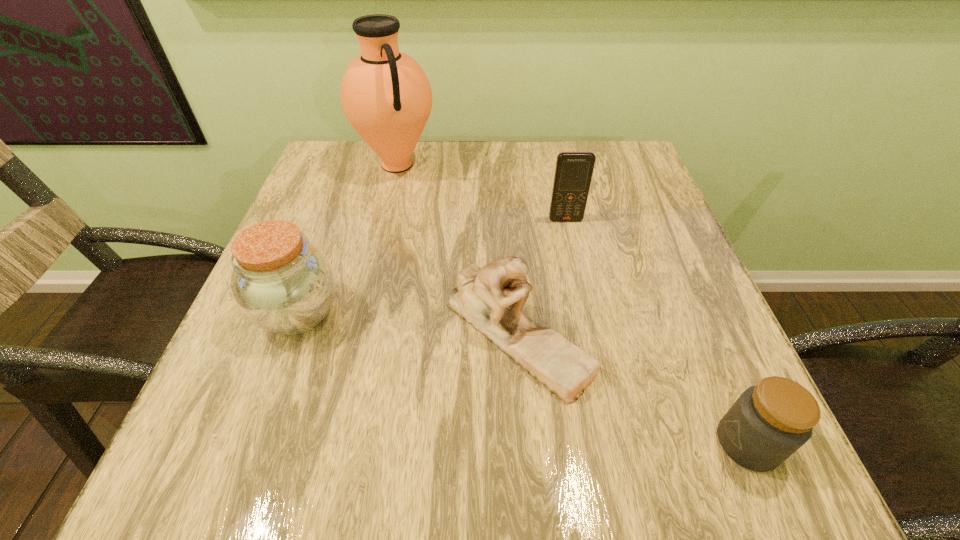
In order to click on the farthest object in this screenshot , I will do `click(385, 94)`.

Identify the location of the tallest object. (385, 94).

You are a GUI agent. You are given a task and a screenshot of the screen. Output one action in this format:
    pyautogui.click(x=<x>, y=<y>)
    Task: Click on the farther jar
    The image size is (960, 540).
    Given the screenshot: What is the action you would take?
    pyautogui.click(x=282, y=283)

The width and height of the screenshot is (960, 540). Find the location of `the left jar`. the left jar is located at coordinates pos(282,283).

Identify the location of cellular telephone. Image resolution: width=960 pixels, height=540 pixels. (573, 173).

Find the location of a particular element. This screenshot has height=540, width=960. figurine is located at coordinates (491, 298).

Image resolution: width=960 pixels, height=540 pixels. I want to click on the nearest object, so click(x=770, y=421).

Where is `the shorter jar`? the shorter jar is located at coordinates (770, 421).

Find the location of a particular element. This screenshot has width=960, height=540. free space located 0.300m on the right of the farthest object is located at coordinates (552, 165).

Where is `vacant position located on the front of the farther jar`? vacant position located on the front of the farther jar is located at coordinates (243, 462).